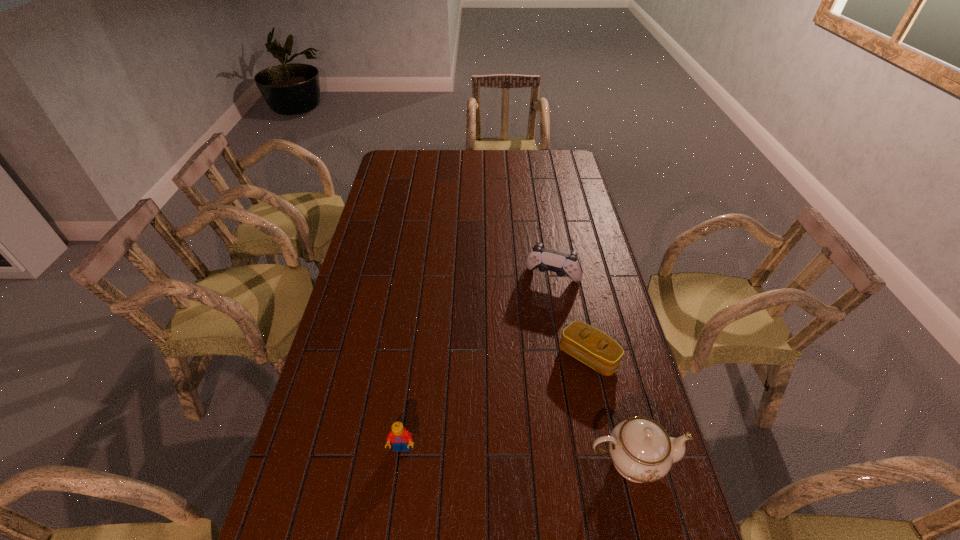
Where is `empty space between the control and the third tallest object`? This screenshot has width=960, height=540. empty space between the control and the third tallest object is located at coordinates (477, 363).

This screenshot has width=960, height=540. I want to click on free spot between the second shortest object and the chinaware, so click(516, 455).

Find the location of a particular element. The image size is (960, 540). free space between the chinaware and the clutch bag is located at coordinates (610, 409).

Locate an element on the screen. The width and height of the screenshot is (960, 540). object that stands as the third closest to the second shortest object is located at coordinates (563, 264).

The image size is (960, 540). What are the coordinates of `object that is the second closest to the shortest object` in the screenshot? It's located at (563, 264).

You are a GUI agent. You are given a task and a screenshot of the screen. Output one action in this format:
    pyautogui.click(x=<x>, y=<y>)
    Task: Click on the blank space that satisfies the following two spatial constraints: 1. on the face of the third tallest object; 2. at the spout of the chinaware
    The image size is (960, 540).
    Given the screenshot: What is the action you would take?
    pyautogui.click(x=400, y=461)

Where is `free space in the image that satisfies the following two spatial constraints: 1. on the front side of the second farthest object; 2. on the left side of the control`? This screenshot has width=960, height=540. free space in the image that satisfies the following two spatial constraints: 1. on the front side of the second farthest object; 2. on the left side of the control is located at coordinates (566, 356).

This screenshot has height=540, width=960. In order to click on vacant space that satisfies the following two spatial constraints: 1. on the face of the Lego; 2. at the spout of the chinaware in this screenshot , I will do [400, 461].

Identify the location of free space that satisfies the following two spatial constraints: 1. on the face of the chinaware; 2. at the spout of the Lego. This screenshot has width=960, height=540. (400, 461).